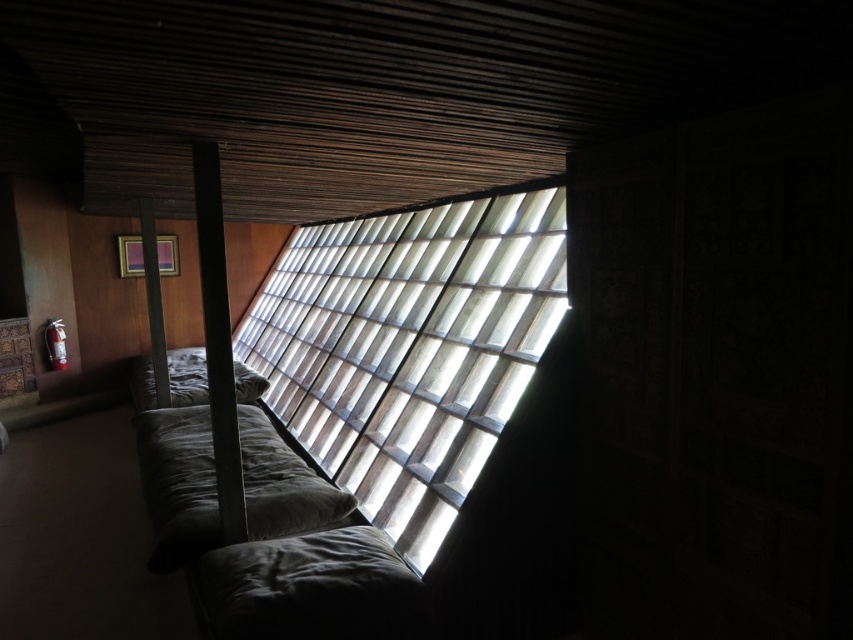
You are standing in the room and want to locate the black matte beam at center. According to the coordinates provided, where should you look relative to the window?

The black matte beam at center is located at coordinates point (218, 340), which is to the right and slightly below the center of the window.

You are standing in the room and want to know which object is wider between the translucent wood window at center and the black matte beam at center. Can you determine this based on their sizes?

The translucent wood window at center is wider than the black matte beam at center, as its width surpasses that of the black matte beam at center.

You are standing in the room and see the point at coordinates (412, 349). What object is this point located on?

The point at coordinates (412, 349) is located on the translucent wood window at center.